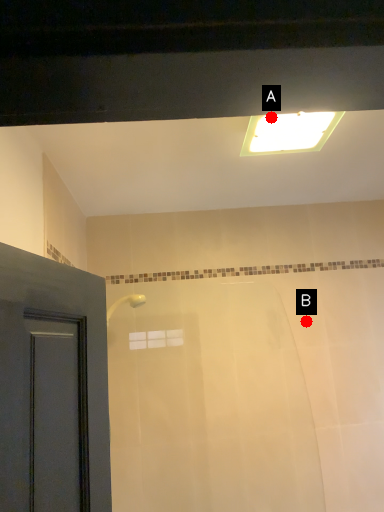
Question: Two points are circled on the image, labeled by A and B beside each circle. Among these points, which one is nearest to the camera?

Choices:
 (A) A is closer
 (B) B is closer

Answer: (A)